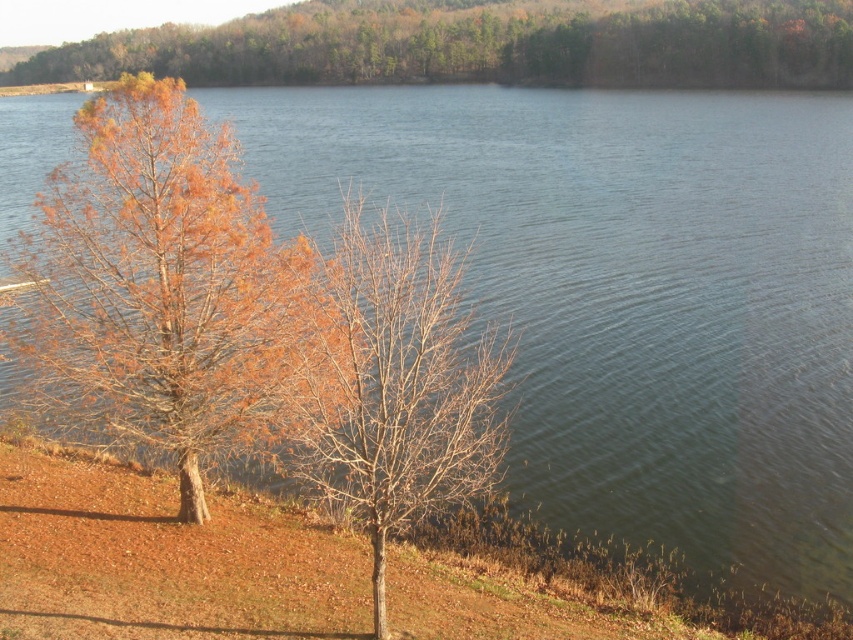
You are planning to install a small boat dock between the brown leafy tree at upper center and the bare branches at center. Given that the dock requires 200 feet of space, will there be enough room between them?

The distance between the brown leafy tree at upper center and the bare branches at center is 401.46 feet, which is more than enough to accommodate the 200 feet required for the dock.